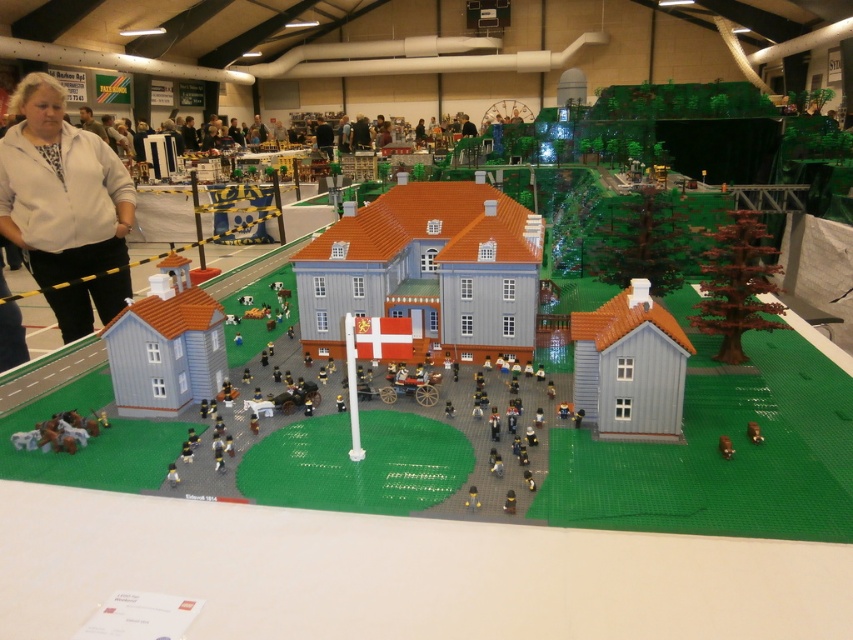
Question: Among these objects, which one is nearest to the camera?

Choices:
 (A) brown matte horse at center
 (B) matte blue house at lower left
 (C) white fabric at left
 (D) brown matte toy animals at lower left

Answer: (A)

Question: From the image, what is the correct spatial relationship of smooth gray house at center in relation to brown matte toy animals at lower left?

Choices:
 (A) left
 (B) right

Answer: (B)

Question: Does matte gray house at lower right have a larger size compared to brown matte toy animals at lower left?

Choices:
 (A) yes
 (B) no

Answer: (A)

Question: Which point is closer to the camera taking this photo?

Choices:
 (A) (177, 403)
 (B) (317, 268)
 (C) (757, 426)
 (D) (62, 416)

Answer: (C)

Question: Which point is farther to the camera?

Choices:
 (A) (73, 420)
 (B) (480, 269)
 (C) (746, 428)

Answer: (B)

Question: In this image, where is matte gray house at lower right located relative to matte blue house at lower left?

Choices:
 (A) right
 (B) left

Answer: (A)